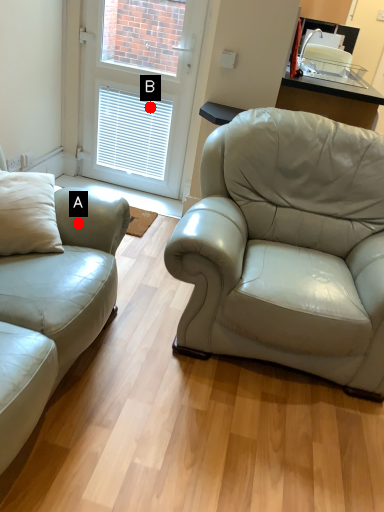
Question: Two points are circled on the image, labeled by A and B beside each circle. Which of the following is the closest to the observer?

Choices:
 (A) A is closer
 (B) B is closer

Answer: (A)